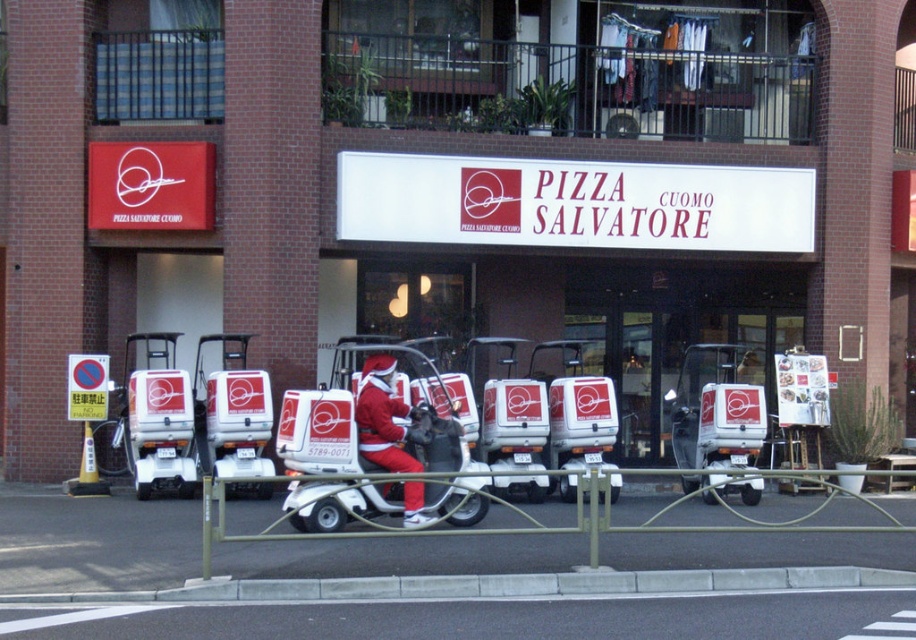
Question: Is white matte golf cart at center thinner than santa claus costume at center?

Choices:
 (A) yes
 (B) no

Answer: (B)

Question: Can you confirm if white matte golf cart at center is positioned above santa claus costume at center?

Choices:
 (A) yes
 (B) no

Answer: (B)

Question: Which object appears farthest from the camera in this image?

Choices:
 (A) white matte golf cart at center
 (B) santa claus costume at center

Answer: (B)

Question: Which point is farther from the camera taking this photo?

Choices:
 (A) (358, 420)
 (B) (463, 442)

Answer: (B)

Question: Does white matte golf cart at center appear on the left side of santa claus costume at center?

Choices:
 (A) no
 (B) yes

Answer: (A)